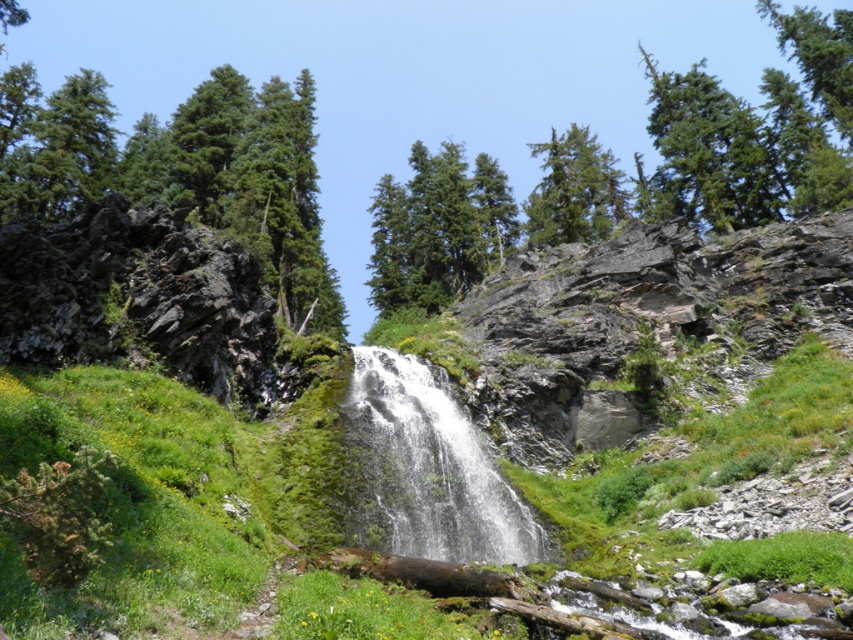
From the picture: You are standing at the base of the cliff looking up at the green mossy hillside at center and the white frothy water at center. Which object is nearer to you?

The green mossy hillside at center is closer to the viewer than the white frothy water at center.

You are an ornithologist observing the green evergreen tree at upper center and the green matte tree at upper center. Which tree is positioned to the left when viewed from the waterfall below?

The green evergreen tree at upper center is positioned to the left of the green matte tree at upper center when viewed from the waterfall below.

You are a hiker standing at the base of the cliff looking up. You see the green evergreen tree at upper center and the brown rough log at center. Which object is higher up the cliff?

The green evergreen tree at upper center is located above the brown rough log at center, so it is higher up the cliff.